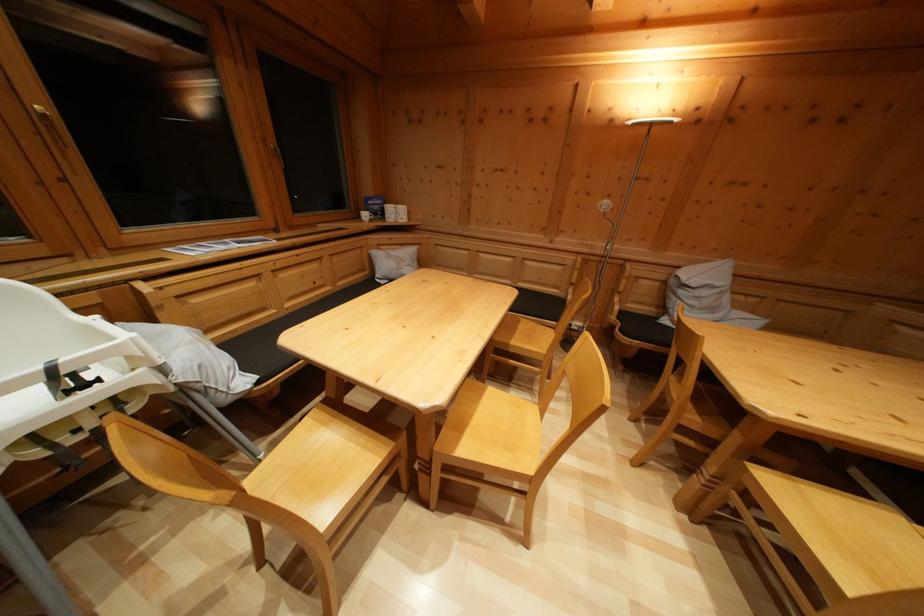
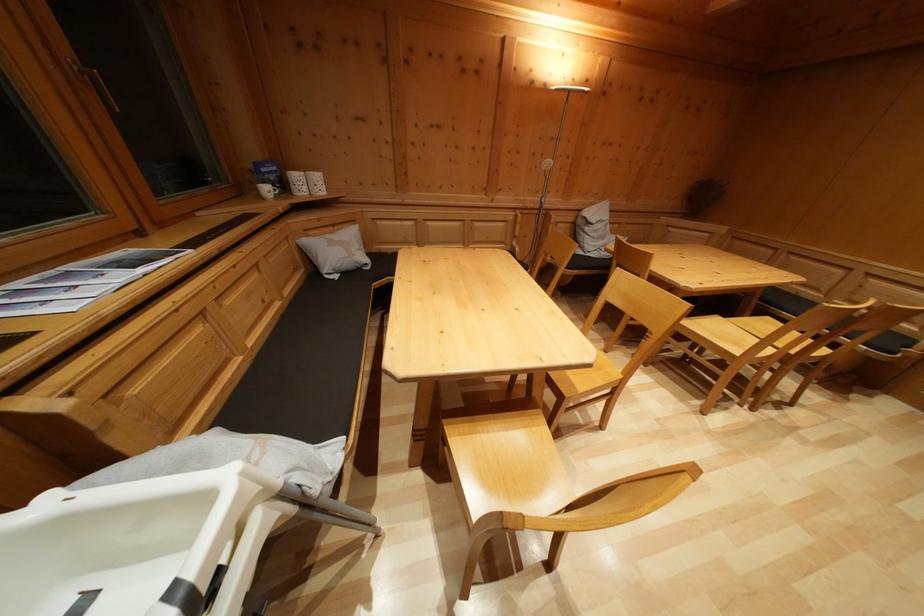
The point at (463, 451) is marked in the first image. Where is the corresponding point in the second image?

(578, 392)